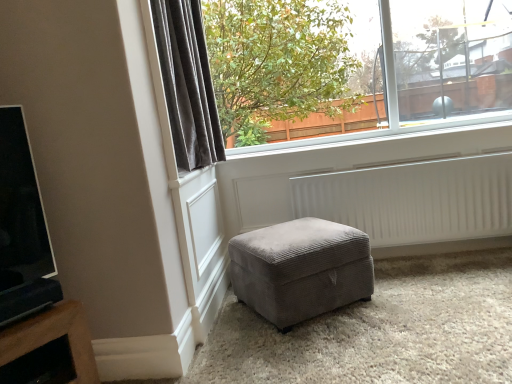
Where is `free location in front of velvet grey ottoman at center`? Image resolution: width=512 pixels, height=384 pixels. free location in front of velvet grey ottoman at center is located at coordinates pyautogui.click(x=331, y=353).